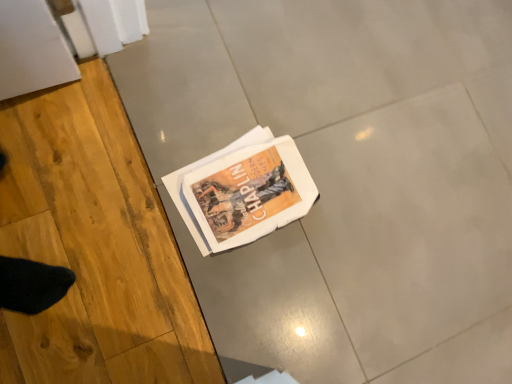
Where is `free space above orange paper magazine at center (from a real-world perspective)`? This screenshot has width=512, height=384. free space above orange paper magazine at center (from a real-world perspective) is located at coordinates (249, 204).